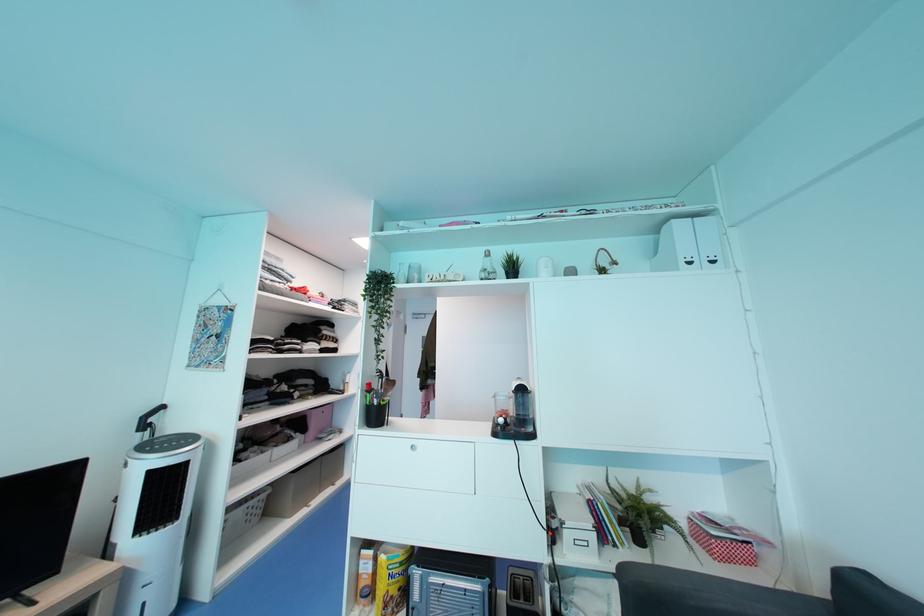
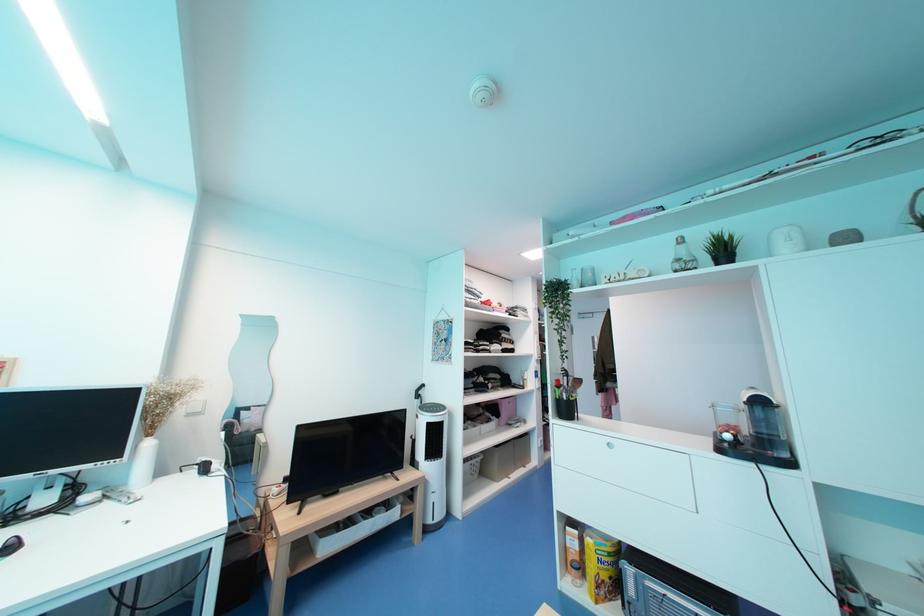
Question: The camera is either moving clockwise (left) or counter-clockwise (right) around the object. The first image is from the beginning of the video and the second image is from the end. Is the camera moving left or right when shooting the video?

Choices:
 (A) Left
 (B) Right

Answer: (B)